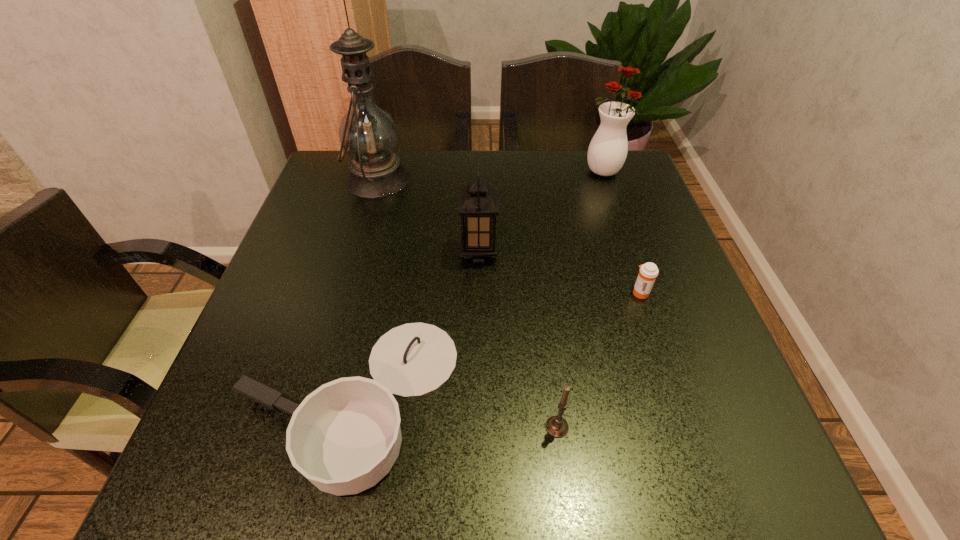
You are a GUI agent. You are given a task and a screenshot of the screen. Output one action in this format:
    pyautogui.click(x=<x>, y=<y>)
    Task: Click on the free spot between the saucepan and the fourth farthest object
    
    Given the screenshot: What is the action you would take?
    pyautogui.click(x=494, y=346)

Where is `empty space between the saucepan and the tallest object`? The width and height of the screenshot is (960, 540). empty space between the saucepan and the tallest object is located at coordinates [363, 289].

This screenshot has width=960, height=540. Identify the location of empty space between the saucepan and the medicine. (494, 346).

The image size is (960, 540). Find the location of `empty location between the fourth nearest object and the third nearest object`. empty location between the fourth nearest object and the third nearest object is located at coordinates (560, 273).

Where is `blank region between the third farthest object and the medicine`? This screenshot has width=960, height=540. blank region between the third farthest object and the medicine is located at coordinates (560, 273).

Where is `free space between the fourth nearest object and the tallest object`? The height and width of the screenshot is (540, 960). free space between the fourth nearest object and the tallest object is located at coordinates (428, 216).

I want to click on free spot between the fourth farthest object and the fourth tallest object, so click(599, 360).

Locate an element on the screen. This screenshot has height=540, width=960. free spot between the medicine and the tallest object is located at coordinates (509, 235).

You are a GUI agent. You are given a task and a screenshot of the screen. Output one action in this format:
    pyautogui.click(x=<x>, y=<y>)
    Task: Click on the free space between the medicine and the fourth nearest object
    
    Given the screenshot: What is the action you would take?
    pos(560,273)

Identify which object is the second closest to the medicine. Please provide its 2D coordinates. Your answer should be formatted as a tuple, i.e. [(x, y)], where the tuple contains the x and y coordinates of a point satisfying the conditions above.

[(556, 426)]